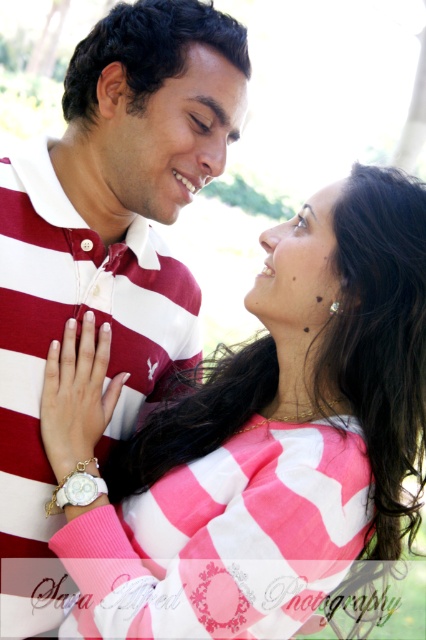
You are a photographer adjusting the focus of your camera. The pink striped sweater at center and the maroon striped polo shirt at center are both in the frame. Given that the minimum focus distance for your camera is 15 inches, will both items be in focus?

The pink striped sweater at center is 15.51 inches away from the maroon striped polo shirt at center. Since the minimum focus distance is 15 inches, the distance between them is sufficient for both items to be in focus.

You are standing at the center of the park and see the point marked at coordinates (256, 436). What object is located at that point?

The pink striped sweater at center is located at point (256, 436).